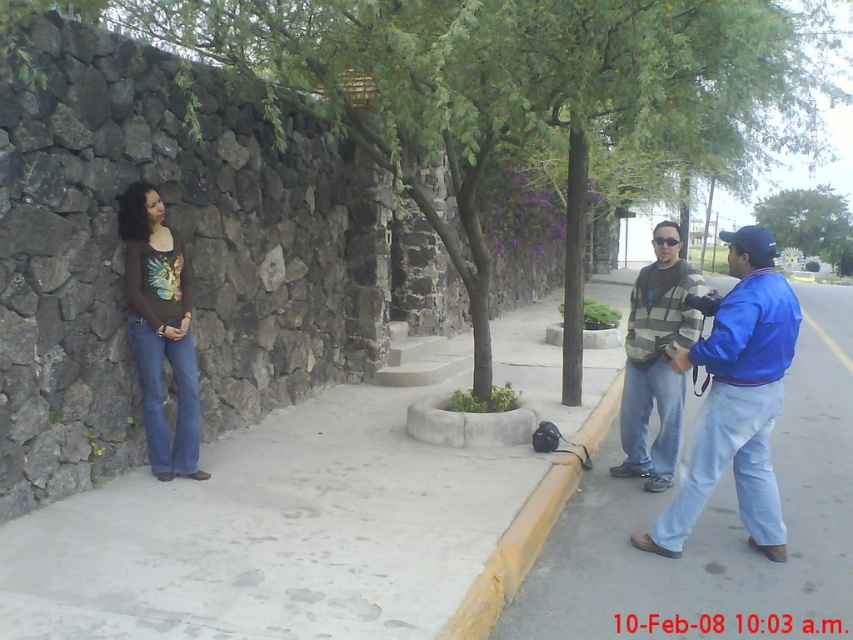
Is striped knit sweater at center below matte brown shirt at left?

Yes, striped knit sweater at center is below matte brown shirt at left.

Which is more to the left, striped knit sweater at center or matte brown shirt at left?

Positioned to the left is matte brown shirt at left.

You are a GUI agent. You are given a task and a screenshot of the screen. Output one action in this format:
    pyautogui.click(x=<x>, y=<y>)
    Task: Click on the striped knit sweater at center
    The image size is (853, 640).
    Given the screenshot: What is the action you would take?
    pyautogui.click(x=735, y=397)

You are a GUI agent. You are given a task and a screenshot of the screen. Output one action in this format:
    pyautogui.click(x=<x>, y=<y>)
    Task: Click on the striped knit sweater at center
    The width and height of the screenshot is (853, 640).
    Given the screenshot: What is the action you would take?
    pyautogui.click(x=735, y=397)

Which is more to the right, concrete sidewalk at center or green leafy tree at upper center?

green leafy tree at upper center is more to the right.

Is concrete sidewalk at center above green leafy tree at upper center?

Actually, concrete sidewalk at center is below green leafy tree at upper center.

Which is in front, point (9, 602) or point (782, 248)?

Point (9, 602) is in front.

Locate an element on the screen. concrete sidewalk at center is located at coordinates (273, 534).

Who is more forward, (105, 596) or (605, 429)?

Point (105, 596) is more forward.

Identify the location of concrete sidewalk at center. The height and width of the screenshot is (640, 853). (273, 534).

Is point (399, 502) farther from camera compared to point (582, 433)?

No, (399, 502) is in front of (582, 433).

You are a GUI agent. You are given a task and a screenshot of the screen. Output one action in this format:
    pyautogui.click(x=<x>, y=<y>)
    Task: Click on the concrete sidewalk at center
    The image size is (853, 640).
    Given the screenshot: What is the action you would take?
    pyautogui.click(x=273, y=534)